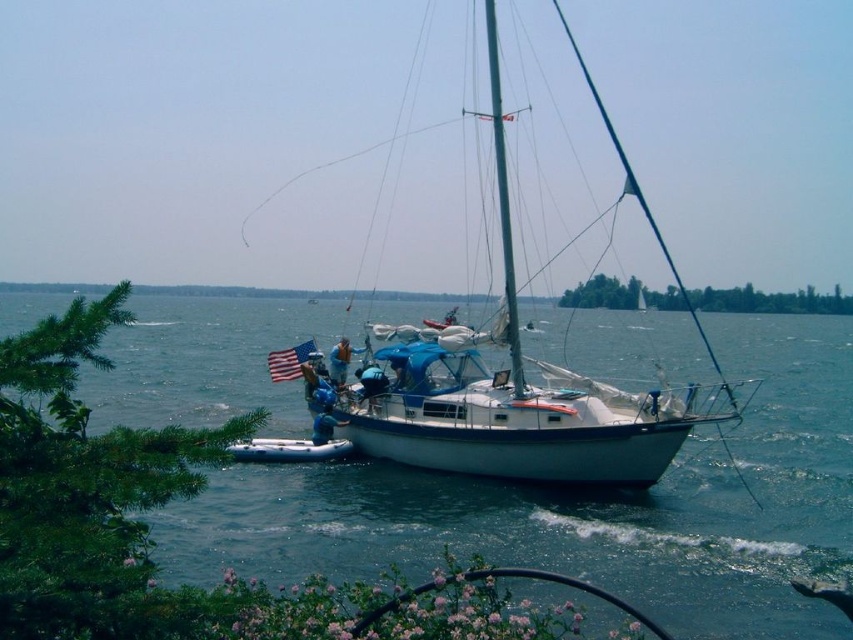
Is white rubber dinghy at lower center positioned before blue rubber boot at center?

Yes, white rubber dinghy at lower center is in front of blue rubber boot at center.

From the picture: Which is below, white rubber dinghy at lower center or blue rubber boot at center?

white rubber dinghy at lower center

Between point (244, 456) and point (372, 387), which one is positioned in front?

Positioned in front is point (244, 456).

Locate an element on the screen. The image size is (853, 640). white rubber dinghy at lower center is located at coordinates (289, 451).

Measure the distance between blue rubber boot at center and blue fabric life vest at center.

32.81 inches

Measure the distance between blue rubber boot at center and camera.

blue rubber boot at center is 18.46 meters away from camera.

Is point (386, 390) closer to camera compared to point (323, 413)?

Yes.

Identify the location of blue rubber boot at center. (370, 385).

Does blue water at center lie in front of white glossy sailboat at center?

Yes, it is in front of white glossy sailboat at center.

Does point (828, 481) come closer to viewer compared to point (508, 195)?

Yes.

Locate an element on the screen. blue water at center is located at coordinates (589, 508).